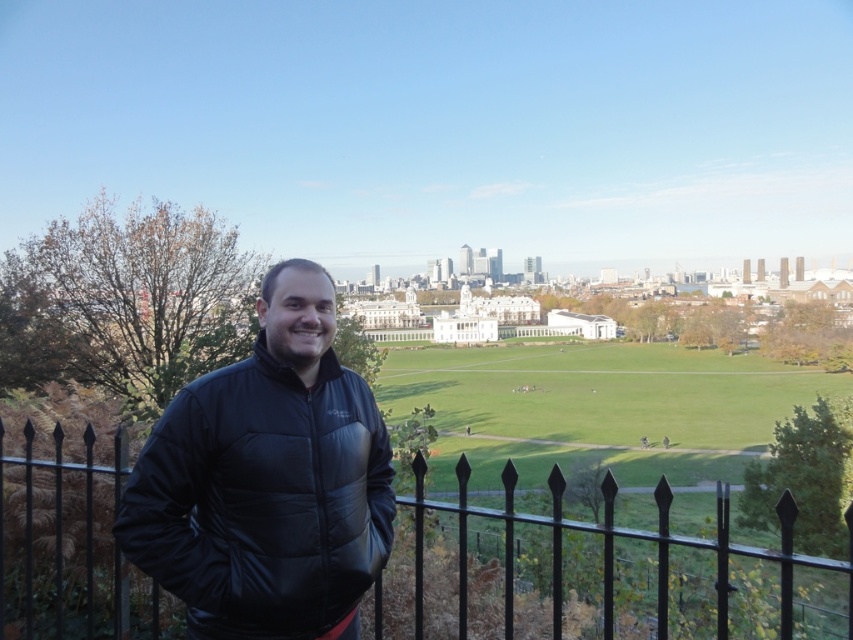
You are a photographer trying to capture a wide shot of the city skyline. You notice the black synthetic jacket at left and the black metal fence at center in your frame. Based on their sizes, which object would be easier to fully include in the photo without cropping?

The black synthetic jacket at left has a smaller width than the black metal fence at center, so it would be easier to fully include the black synthetic jacket at left in the photo without cropping.

You are a photographer trying to capture a clear shot of the city skyline. You notice the black synthetic jacket at left and the black metal fence at center are blocking your view. Which object should you move closer to the camera to ensure the skyline remains visible?

The black synthetic jacket at left is taller than the black metal fence at center, so moving the black synthetic jacket at left closer to the camera would lower its obstruction, allowing the skyline to be seen more clearly.

You are a photographer planning to take a photo of the black synthetic jacket at left and the black metal fence at center. The minimum distance required between the camera and the subject for clear focus is 100 feet. Will you be able to capture both subjects in focus if you position the camera at your current location?

The black synthetic jacket at left and black metal fence at center are 88.22 feet apart. Since the required minimum distance for clear focus is 100 feet, the camera cannot maintain focus on both subjects simultaneously as the distance between them is less than the required focus distance.